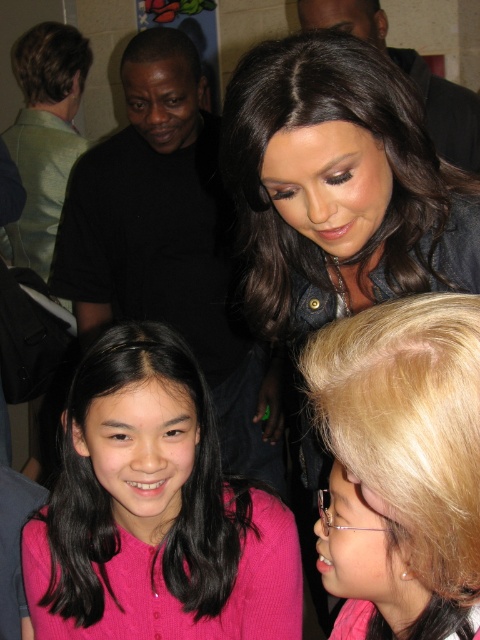
Question: Considering the real-world distances, which object is closest to the pink knitted sweater at center?

Choices:
 (A) shiny black hair at center
 (B) blonde hair at upper right

Answer: (A)

Question: Which point is farther to the camera?

Choices:
 (A) pink knitted sweater at center
 (B) blonde hair at upper right

Answer: (A)

Question: Can you confirm if shiny black hair at center is wider than pink knitted sweater at center?

Choices:
 (A) yes
 (B) no

Answer: (B)

Question: Which point is closer to the camera?

Choices:
 (A) pink knitted sweater at center
 (B) shiny black hair at center
 (C) blonde hair at upper right

Answer: (C)

Question: Is shiny black hair at center positioned before pink knitted sweater at center?

Choices:
 (A) no
 (B) yes

Answer: (B)

Question: Can you confirm if shiny black hair at center is smaller than blonde hair at upper right?

Choices:
 (A) yes
 (B) no

Answer: (B)